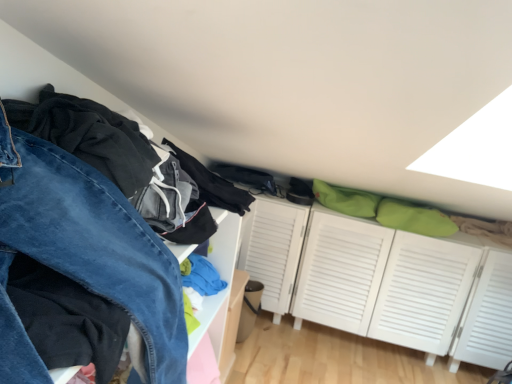
What do you see at coordinates (82, 253) in the screenshot? This screenshot has width=512, height=384. I see `denim pants at left` at bounding box center [82, 253].

Where is `denim pants at left`? This screenshot has height=384, width=512. denim pants at left is located at coordinates (82, 253).

What do you see at coordinates (406, 288) in the screenshot?
I see `white louvered cabinet at center` at bounding box center [406, 288].

Measure the distance between white louvered cabinet at center and camera.

A distance of 2.01 meters exists between white louvered cabinet at center and camera.

Where is `white louvered cabinet at center`? This screenshot has height=384, width=512. white louvered cabinet at center is located at coordinates (406, 288).

Locate an element on the screen. The height and width of the screenshot is (384, 512). denim pants at left is located at coordinates (82, 253).

Which object is positioned more to the left, denim pants at left or white louvered cabinet at center?

Positioned to the left is denim pants at left.

Which object is further away from the camera taking this photo, denim pants at left or white louvered cabinet at center?

white louvered cabinet at center is more distant.

Does point (118, 243) appear closer or farther from the camera than point (451, 285)?

Point (118, 243) appears to be closer to the viewer than point (451, 285).

From the image's perspective, between denim pants at left and white louvered cabinet at center, which one is located above?

white louvered cabinet at center, from the image's perspective.

From a real-world perspective, which is physically above, denim pants at left or white louvered cabinet at center?

denim pants at left, from a real-world perspective.

Considering the sizes of denim pants at left and white louvered cabinet at center in the image, is denim pants at left wider or thinner than white louvered cabinet at center?

Clearly, denim pants at left has less width compared to white louvered cabinet at center.

Considering the relative sizes of denim pants at left and white louvered cabinet at center in the image provided, is denim pants at left shorter than white louvered cabinet at center?

No, denim pants at left is not shorter than white louvered cabinet at center.

Is denim pants at left smaller than white louvered cabinet at center?

Indeed, denim pants at left has a smaller size compared to white louvered cabinet at center.

Would you say denim pants at left is outside white louvered cabinet at center?

Yes, denim pants at left is not within white louvered cabinet at center.

Is denim pants at left not near white louvered cabinet at center?

Yes, denim pants at left and white louvered cabinet at center are quite far apart.

Could you tell me if denim pants at left is turned towards white louvered cabinet at center?

No, denim pants at left is not oriented towards white louvered cabinet at center.

How many degrees apart are the facing directions of denim pants at left and white louvered cabinet at center?

The angular difference between denim pants at left and white louvered cabinet at center is 89.4 degrees.

Measure the distance from denim pants at left to white louvered cabinet at center.

A distance of 1.52 meters exists between denim pants at left and white louvered cabinet at center.

This screenshot has width=512, height=384. What are the coordinates of `dresser that is above the denim pants at left (from the image's perspective)` in the screenshot? It's located at (406, 288).

Considering the positions of objects white louvered cabinet at center and denim pants at left in the image provided, who is more to the left, white louvered cabinet at center or denim pants at left?

From the viewer's perspective, denim pants at left appears more on the left side.

Considering their positions, is white louvered cabinet at center located in front of or behind denim pants at left?

Clearly, white louvered cabinet at center is behind denim pants at left.

Between point (505, 274) and point (13, 367), which one is positioned behind?

Point (505, 274)

From the image's perspective, is white louvered cabinet at center on denim pants at left?

Yes, from the image's perspective, white louvered cabinet at center is on top of denim pants at left.

From a real-world perspective, is white louvered cabinet at center over denim pants at left?

Actually, white louvered cabinet at center is physically below denim pants at left in the real world.

Is white louvered cabinet at center thinner than denim pants at left?

No.

Is white louvered cabinet at center taller than denim pants at left?

In fact, white louvered cabinet at center may be shorter than denim pants at left.

Looking at the image, does white louvered cabinet at center seem bigger or smaller compared to denim pants at left?

Considering their sizes, white louvered cabinet at center takes up more space than denim pants at left.

Based on the photo, is white louvered cabinet at center completely or partially outside of denim pants at left?

white louvered cabinet at center lies outside denim pants at left's area.

Is white louvered cabinet at center positioned far away from denim pants at left?

That's right, there is a large distance between white louvered cabinet at center and denim pants at left.

Looking at this image, could you tell me if white louvered cabinet at center is facing denim pants at left?

Yes, white louvered cabinet at center faces towards denim pants at left.

Locate an element on the screen. This screenshot has height=384, width=512. dresser on the right side of denim pants at left is located at coordinates (406, 288).

The image size is (512, 384). Identify the location of trousers located below the white louvered cabinet at center (from the image's perspective). (82, 253).

At what (x,y) coordinates should I click in order to perform the action: click on dresser above the denim pants at left (from the image's perspective). Please return your answer as a coordinate pair (x, y). Looking at the image, I should click on (406, 288).